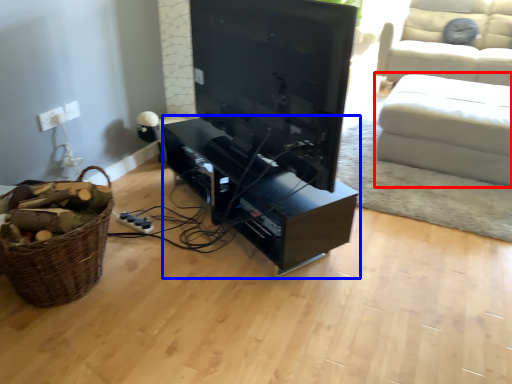
Question: Which object is further to the camera taking this photo, studio couch (highlighted by a red box) or entertainment center (highlighted by a blue box)?

Choices:
 (A) studio couch
 (B) entertainment center

Answer: (A)